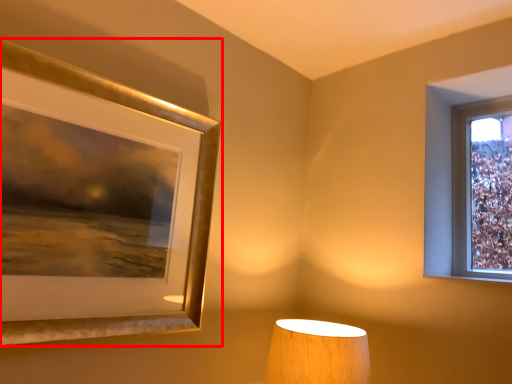
Question: From the image's perspective, what is the correct spatial relationship of picture frame (annotated by the red box) in relation to lamp?

Choices:
 (A) above
 (B) below

Answer: (A)